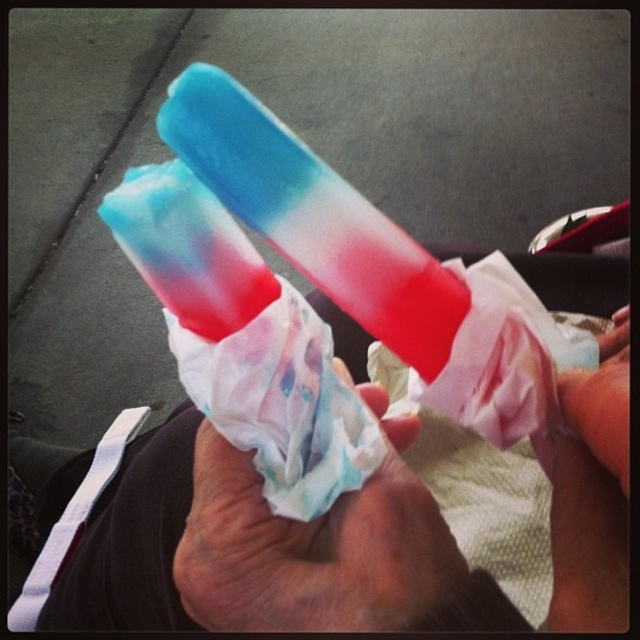
Question: From the image, what is the correct spatial relationship of translucent paper popsicle at center in relation to matte paper towel at center?

Choices:
 (A) right
 (B) left

Answer: (B)

Question: Which point is farther to the camera?

Choices:
 (A) matte plastic hand at lower right
 (B) translucent paper popsicle at center
 (C) matte paper towel at center

Answer: (C)

Question: Does matte paper towel at center have a lesser width compared to matte plastic hand at lower right?

Choices:
 (A) no
 (B) yes

Answer: (A)

Question: Is translucent paper popsicle at center thinner than matte paper towel at center?

Choices:
 (A) yes
 (B) no

Answer: (B)

Question: Which point appears farthest from the camera in this image?

Choices:
 (A) (113, 593)
 (B) (321, 563)
 (C) (588, 442)

Answer: (A)

Question: Estimate the real-world distances between objects in this image. Which object is closer to the matte paper towel at center?

Choices:
 (A) translucent paper popsicle at center
 (B) matte plastic hand at lower right

Answer: (B)